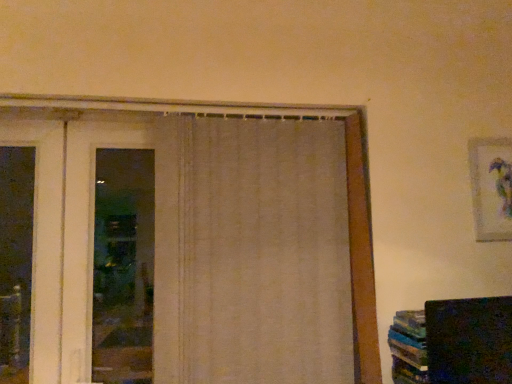
Question: Would you say white fabric door at left is outside beige fabric curtain at center?

Choices:
 (A) yes
 (B) no

Answer: (A)

Question: Considering the relative sizes of white fabric door at left and beige fabric curtain at center in the image provided, is white fabric door at left taller than beige fabric curtain at center?

Choices:
 (A) no
 (B) yes

Answer: (A)

Question: Are white fabric door at left and beige fabric curtain at center making contact?

Choices:
 (A) yes
 (B) no

Answer: (B)

Question: Can you confirm if white fabric door at left is smaller than beige fabric curtain at center?

Choices:
 (A) no
 (B) yes

Answer: (B)

Question: Does white fabric door at left appear on the right side of beige fabric curtain at center?

Choices:
 (A) no
 (B) yes

Answer: (A)

Question: Considering the positions of white fabric door at left and beige fabric curtain at center in the image, is white fabric door at left wider or thinner than beige fabric curtain at center?

Choices:
 (A) thin
 (B) wide

Answer: (A)

Question: Is white fabric door at left spatially inside beige fabric curtain at center, or outside of it?

Choices:
 (A) inside
 (B) outside

Answer: (B)

Question: In terms of size, does white fabric door at left appear bigger or smaller than beige fabric curtain at center?

Choices:
 (A) big
 (B) small

Answer: (B)

Question: Relative to beige fabric curtain at center, is white fabric door at left in front or behind?

Choices:
 (A) behind
 (B) front

Answer: (A)

Question: Would you say beige fabric curtain at center is to the left or to the right of matte white picture frame at upper right in the picture?

Choices:
 (A) left
 (B) right

Answer: (A)

Question: From the image's perspective, relative to matte white picture frame at upper right, is beige fabric curtain at center above or below?

Choices:
 (A) below
 (B) above

Answer: (A)

Question: From a real-world perspective, is beige fabric curtain at center physically located above or below matte white picture frame at upper right?

Choices:
 (A) below
 (B) above

Answer: (A)

Question: Relative to matte white picture frame at upper right, is beige fabric curtain at center in front or behind?

Choices:
 (A) front
 (B) behind

Answer: (A)

Question: From a real-world perspective, is beige fabric curtain at center physically located above or below white fabric door at left?

Choices:
 (A) below
 (B) above

Answer: (A)

Question: Considering the positions of beige fabric curtain at center and white fabric door at left in the image, is beige fabric curtain at center taller or shorter than white fabric door at left?

Choices:
 (A) tall
 (B) short

Answer: (A)